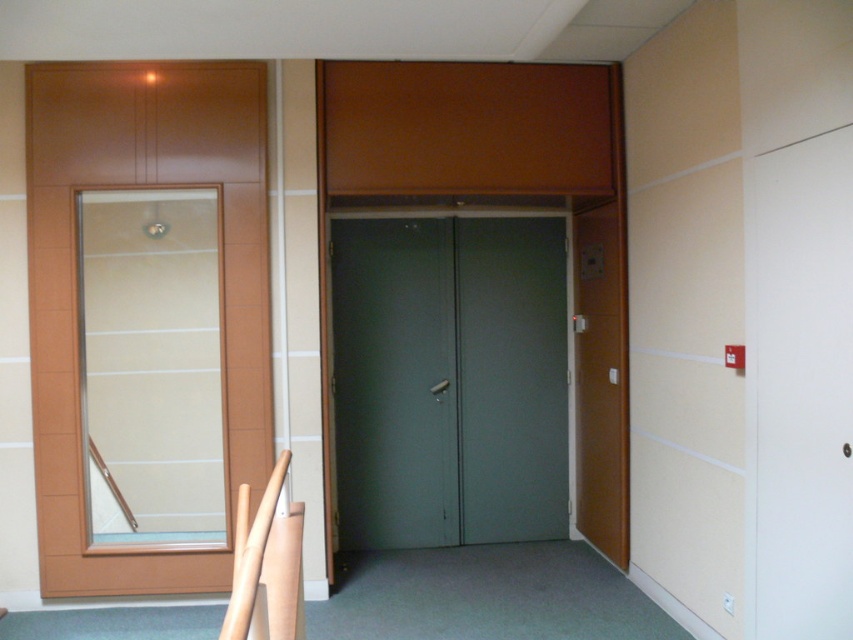
You are a delivery person trying to enter the building through the doors. The transparent glass door at center and the matte gray door at center are both in front of you. Which door should you open first if you want to enter the building?

The transparent glass door at center is bigger than the matte gray door at center, so you should open the transparent glass door at center first as it is likely the main entrance.

You are standing in front of the double doors and want to exit through the transparent glass door at left. However, you notice that the matte brown door at right has a sign indicating it is an emergency exit. Which door should you use to exit safely?

The emergency exit sign on the matte brown door at right indicates it is the correct door to use during an emergency, so you should exit through the matte brown door at right.